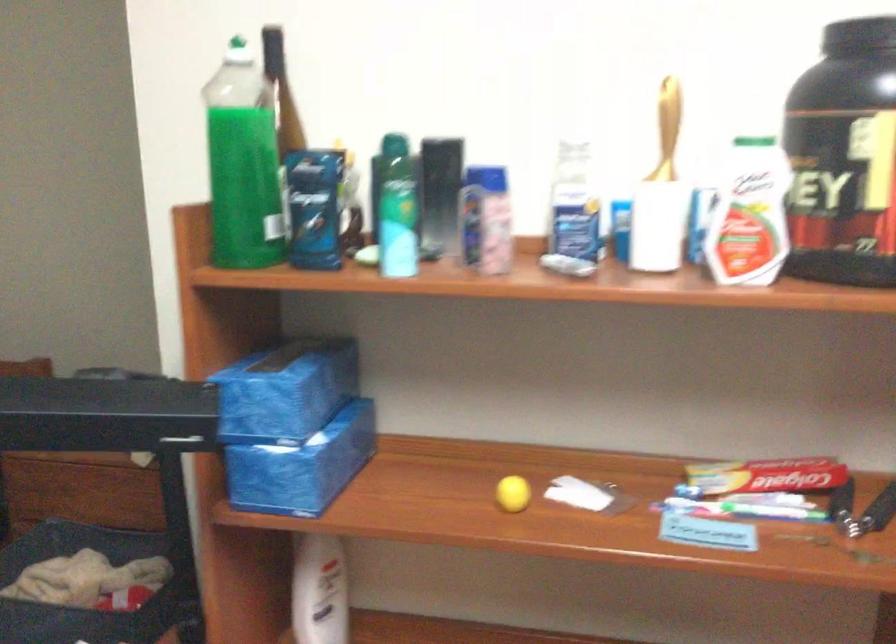
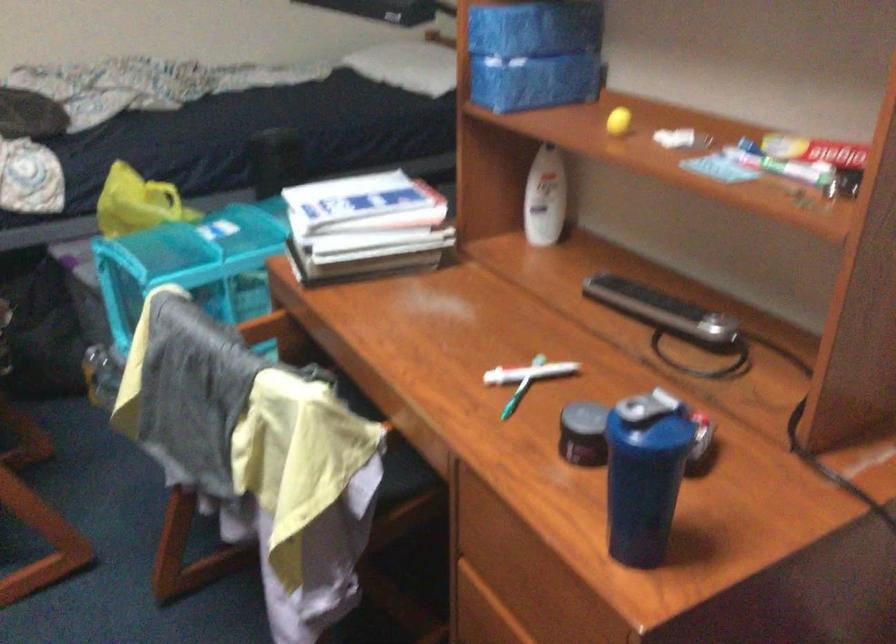
Locate, in the second image, the point that corresponds to point (320, 386) in the first image.

(536, 26)